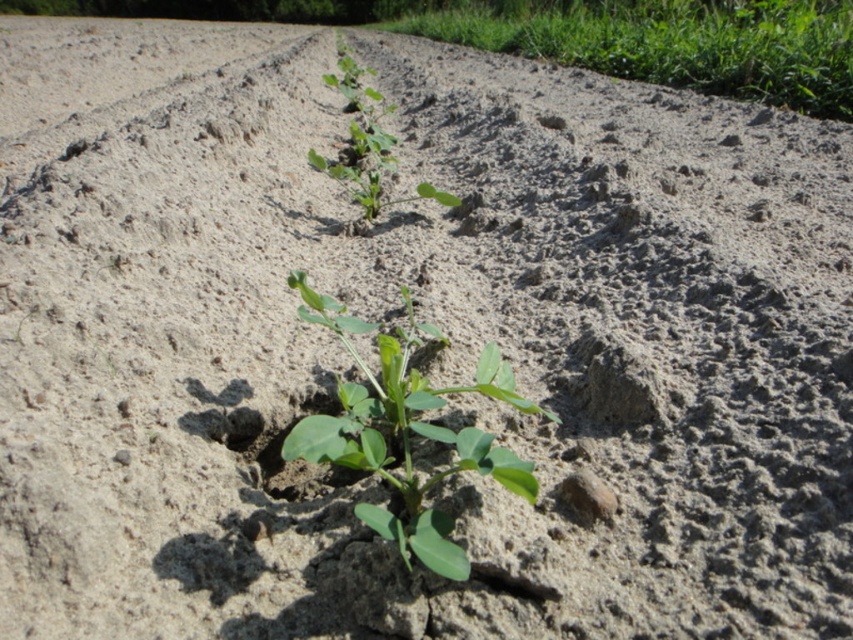
You are a farmer checking the growth of your crops. You have two plants in your field, the green leafy plant at upper right and the green matte plant at center. Which plant is bigger?

The green leafy plant at upper right is larger in size compared to the green matte plant at center.

You are a farmer checking the growth of your crops. You notice the green leafy plant at upper right and the green matte plant at center. Which plant has a wider spread of leaves?

The green leafy plant at upper right has a wider spread of leaves than the green matte plant at center.